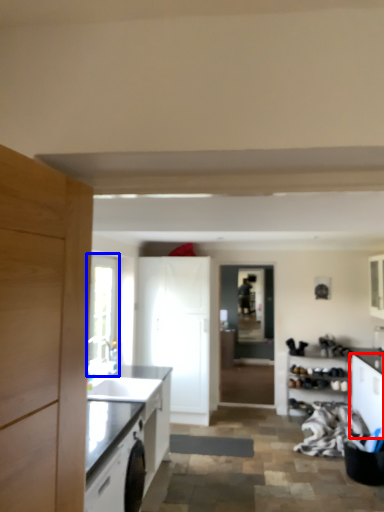
Question: Which of the following is the farthest to the observer, cabinetry (highlighted by a red box) or window (highlighted by a blue box)?

Choices:
 (A) cabinetry
 (B) window

Answer: (B)